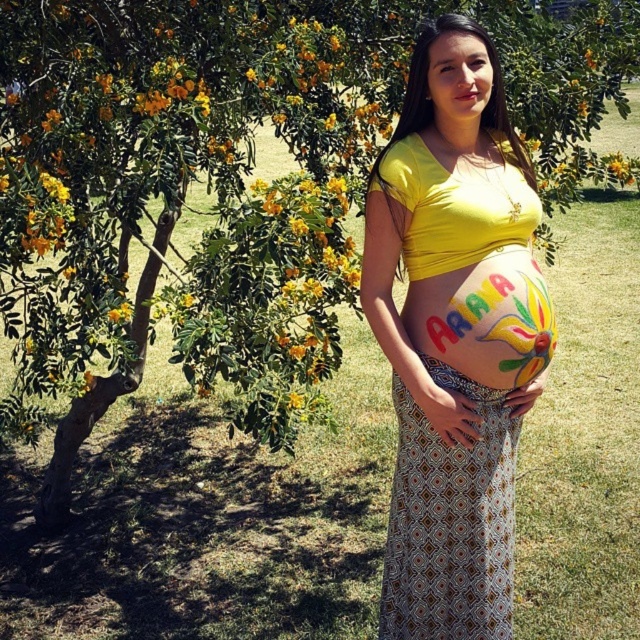
You are a photographer planning to take a portrait of the pregnant woman in the scene. You want to ensure that the patterned fabric dress at center is centered in the frame. Given its current position at point coordinates, what adjustment should you make to the camera to achieve this?

The patterned fabric dress at center is already positioned at point coordinates, so no adjustment is needed to center it in the frame.

In the scene shown: You are a photographer preparing to take a portrait of the woman in the image. You notice the matte yellow shirt at center and the patterned fabric dress at center. Which clothing item is visible on top?

The matte yellow shirt at center is positioned over the patterned fabric dress at center, so the matte yellow shirt at center is visible on top.

You are a photographer trying to capture the woman in the scene. You want to ensure that both the matte yellow shirt at center and the painted colorful belly at center are clearly visible in the photo. Which object should you focus on to ensure both are in frame?

Since the matte yellow shirt at center might be wider than the painted colorful belly at center, you should focus on the matte yellow shirt at center to ensure both are in frame.